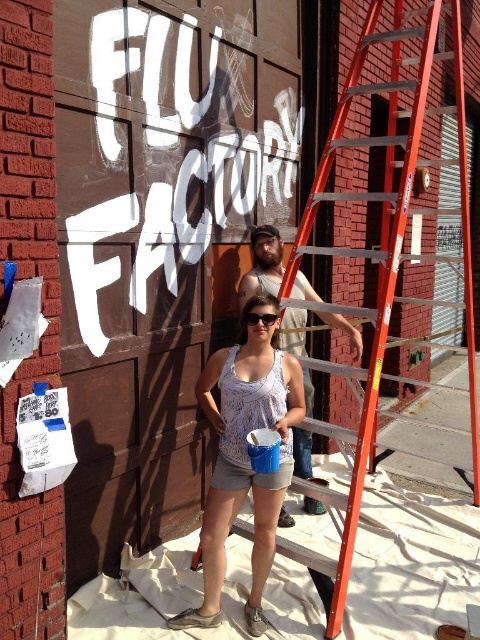
The height and width of the screenshot is (640, 480). What do you see at coordinates (386, 240) in the screenshot? I see `orange metallic ladder at center` at bounding box center [386, 240].

Is point (396, 232) less distant than point (263, 225)?

Yes, point (396, 232) is closer to viewer.

This screenshot has width=480, height=640. I want to click on orange metallic ladder at center, so pos(386,240).

Where is `orange metallic ladder at center`? The height and width of the screenshot is (640, 480). orange metallic ladder at center is located at coordinates (386, 240).

Does tank top at center have a greater height compared to black plastic goggles at center?

Correct, tank top at center is much taller as black plastic goggles at center.

Does point (276, 280) come closer to viewer compared to point (276, 314)?

That is False.

Is point (348, 332) farther from viewer compared to point (276, 317)?

Yes.

You are a GUI agent. You are given a task and a screenshot of the screen. Output one action in this format:
    pyautogui.click(x=<x>, y=<y>)
    Task: Click on the tank top at center
    Image resolution: width=480 pixels, height=640 pixels.
    Given the screenshot: What is the action you would take?
    pyautogui.click(x=263, y=264)

Can you confirm if orange metallic ladder at center is positioned to the left of white printed tank top at center?

Incorrect, orange metallic ladder at center is not on the left side of white printed tank top at center.

Is point (368, 20) closer to camera compared to point (296, 374)?

No, it is not.

What are the coordinates of `orange metallic ladder at center` in the screenshot? It's located at (386, 240).